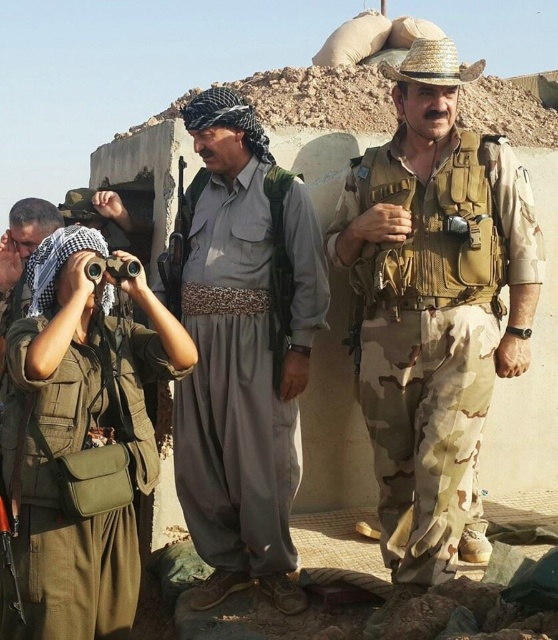
You are a field medic trying to locate the camouflage fabric vest at right in the scene. Based on the coordinates provided, where should you look relative to the center of the image?

The camouflage fabric vest at right is located at point (x=434, y=332), which means it is positioned to the right and slightly below the center of the image.

You are a security officer in the desert scene. You need to quickly identify the person wearing gray fabric pants at center and the green fabric uniform at left. Which one is positioned to the right of the other?

The gray fabric pants at center is to the right of green fabric uniform at left, so the person wearing gray fabric pants at center is positioned to the right of the green fabric uniform at left.

Based on the scene description, which object has a larger size between the gray fabric pants at center and the green fabric uniform at left?

The gray fabric pants at center is larger in size than the green fabric uniform at left according to the description.